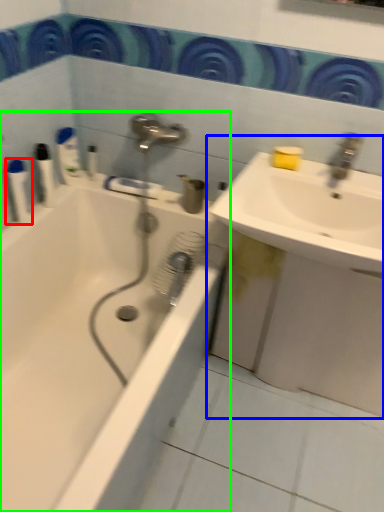
Question: Estimate the real-world distances between objects in this image. Which object is closer to toiletry (highlighted by a red box), sink (highlighted by a blue box) or bathtub (highlighted by a green box)?

Choices:
 (A) sink
 (B) bathtub

Answer: (B)